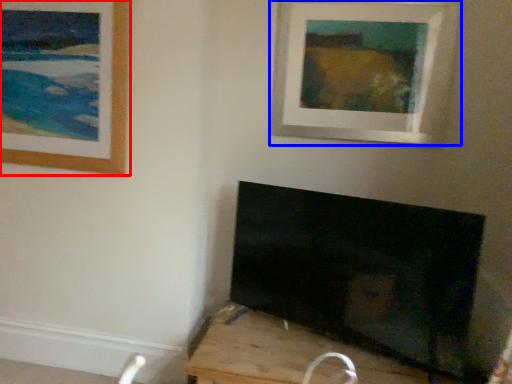
Question: Which object is closer to the camera taking this photo, picture frame (highlighted by a red box) or picture frame (highlighted by a blue box)?

Choices:
 (A) picture frame
 (B) picture frame

Answer: (A)